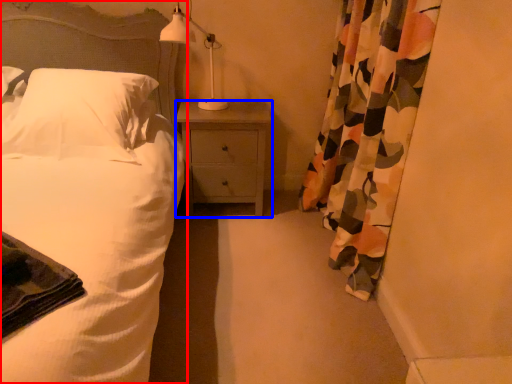
Question: Which of the following is the farthest to the observer, bed (highlighted by a red box) or nightstand (highlighted by a blue box)?

Choices:
 (A) bed
 (B) nightstand

Answer: (B)